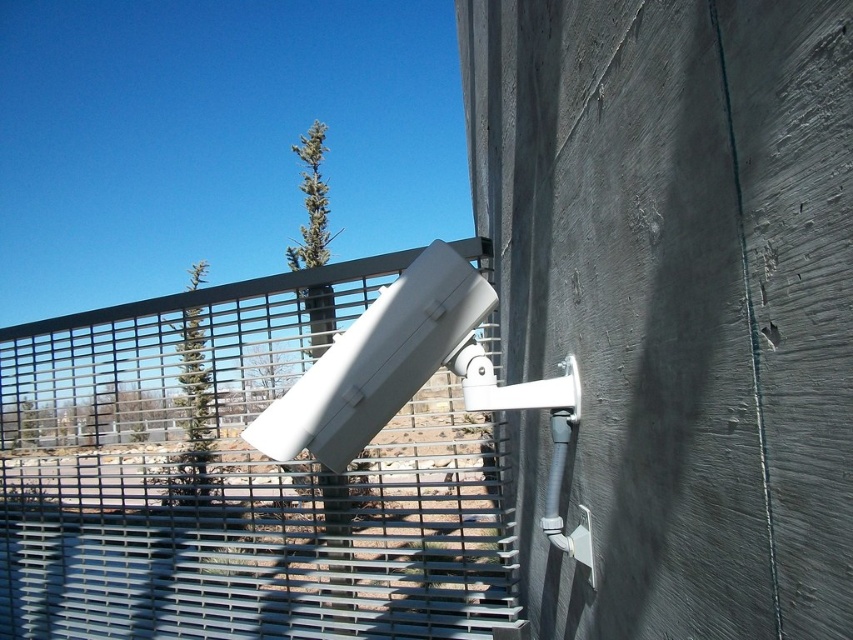
Does metallic gray fence at upper center come behind gray metal blind at lower left?

No.

Describe the element at coordinates (235, 481) in the screenshot. I see `metallic gray fence at upper center` at that location.

The height and width of the screenshot is (640, 853). What are the coordinates of `metallic gray fence at upper center` in the screenshot? It's located at (235, 481).